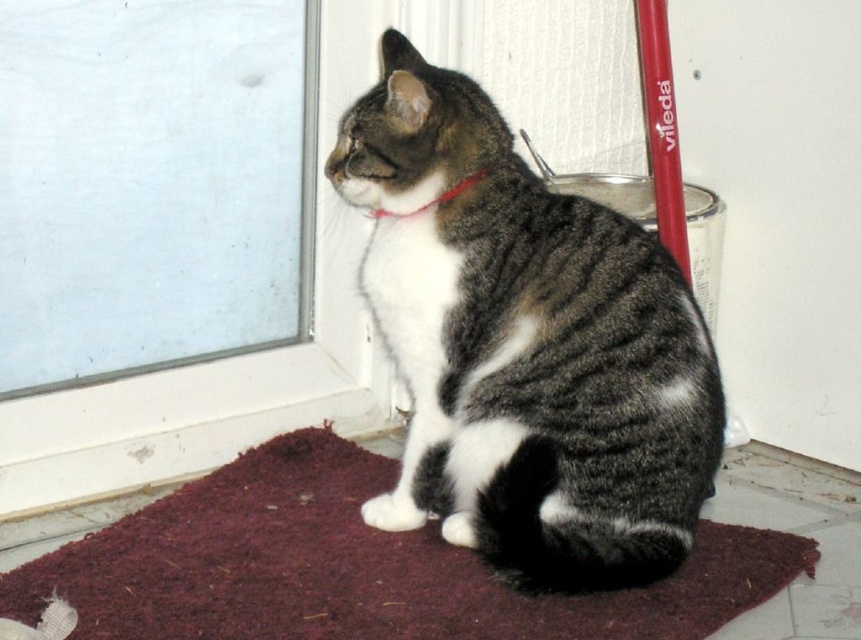
You are standing in a room with a glass door and a cleaning tool. You need to place a new red mat exactly where the tabby fur cat at center is currently sitting. Is the spot at point [525,346] suitable for placing the new mat?

The spot at point [525,346] is currently occupied by the tabby fur cat at center, so placing a new mat there would require the cat to move first.